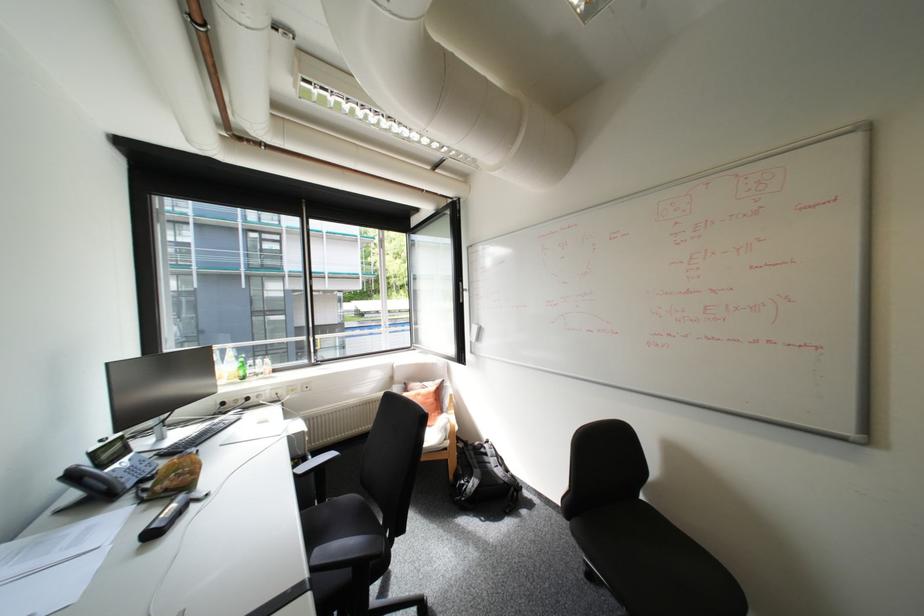
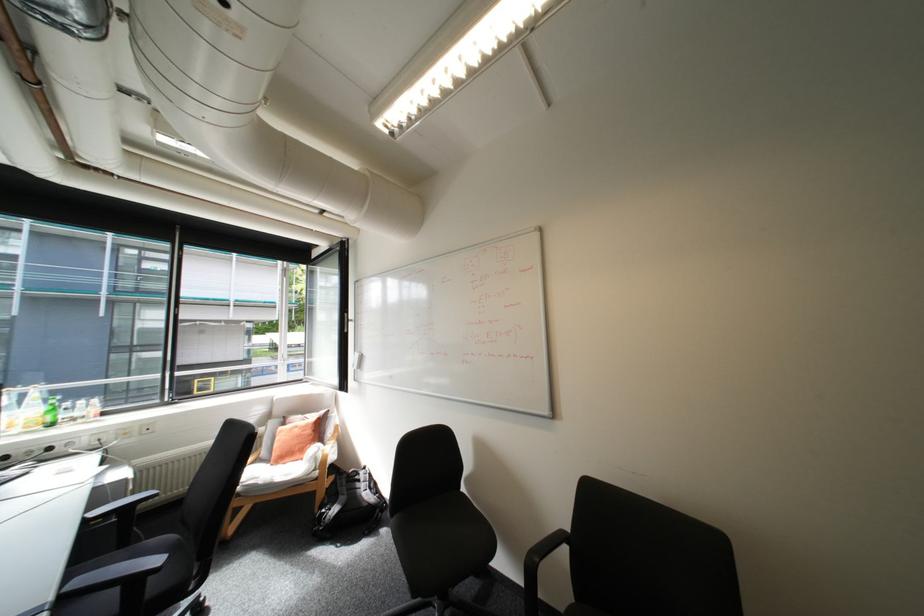
The point at (430,397) is marked in the first image. Where is the corresponding point in the second image?

(307, 429)